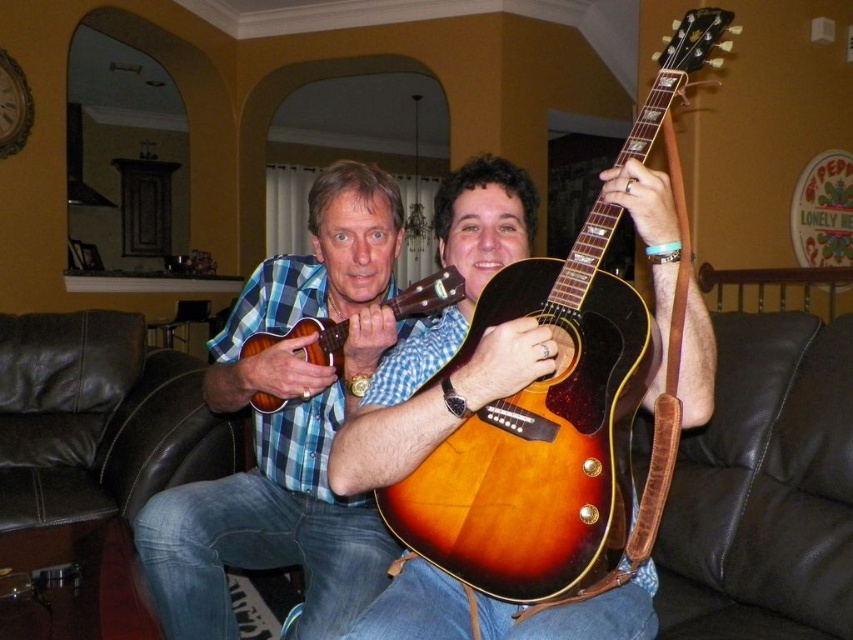
You are a photographer setting up for a shoot in this living room. You need to place a small tripod between the satin brown guitar at center and the brown leather armchair at right. Based on their positions, will the tripod be placed on the guitar or the armchair?

The satin brown guitar at center is positioned over the brown leather armchair at right, so the tripod would be placed on the guitar since it is above the armchair.

You are a photographer setting up a shoot in the living room. You need to position a camera stand so that it can capture both the satin brown guitar at center and the satin wood guitar at center without moving the stand. Given their heights, which guitar will appear taller in the photo?

The satin brown guitar at center will appear taller in the photo because it is taller than the satin wood guitar at center as stated in the description.

From the picture: You are designing a display case for a music store. The case has a height limit of 30 cm. You need to place both the satin wood guitar at center and the matte plaid shirt at center inside. Based on the image, will both items fit vertically in the display case?

The satin wood guitar at center has a lesser height compared to matte plaid shirt at center. Since the display case has a 30 cm height limit, both items can fit vertically only if the taller item, the matte plaid shirt at center, is under 30 cm in height. However, without knowing the exact height of the matte plaid shirt at center, we cannot confirm if both will fit.